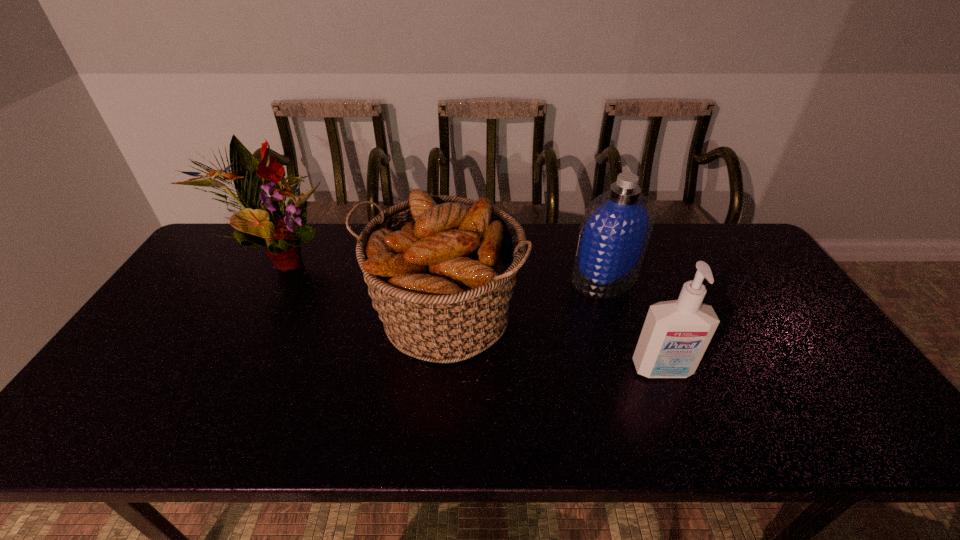
I want to click on bouquet, so click(265, 221).

This screenshot has width=960, height=540. In order to click on the farther cleansing agent in this screenshot , I will do `click(615, 230)`.

Find the location of a particular element. This screenshot has width=960, height=540. basket is located at coordinates (440, 269).

The height and width of the screenshot is (540, 960). What are the coordinates of `the nearer cleansing agent` in the screenshot? It's located at (675, 335).

Where is `blank area located on the front-facing side of the leftmost object`? blank area located on the front-facing side of the leftmost object is located at coordinates (443, 259).

Identify the location of free space located on the left of the farther cleansing agent. The image size is (960, 540). (501, 278).

The height and width of the screenshot is (540, 960). I want to click on vacant space located 0.110m on the left of the second object from left to right, so click(325, 317).

At what (x,y) coordinates should I click in order to perform the action: click on vacant space located on the front label of the nearer cleansing agent. Please return your answer as a coordinate pair (x, y). The height and width of the screenshot is (540, 960). Looking at the image, I should click on (677, 410).

At what (x,y) coordinates should I click in order to perform the action: click on bouquet that is positioned at the far edge. Please return your answer as a coordinate pair (x, y). Looking at the image, I should click on (265, 221).

Where is `cleansing agent located in the far edge section of the desktop`? The width and height of the screenshot is (960, 540). cleansing agent located in the far edge section of the desktop is located at coordinates (615, 230).